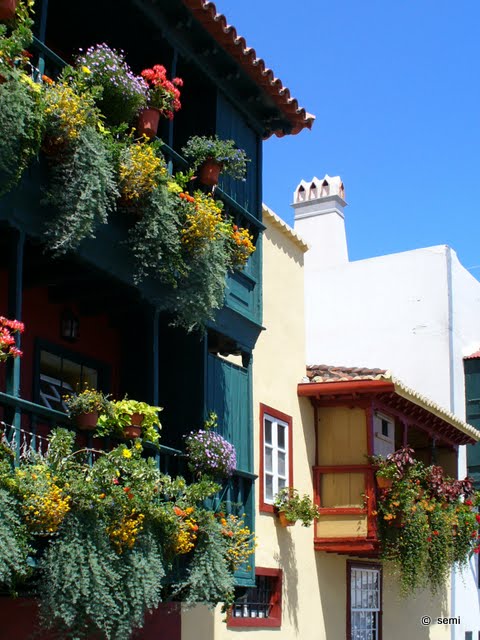
The width and height of the screenshot is (480, 640). I want to click on chimney, so click(x=320, y=225).